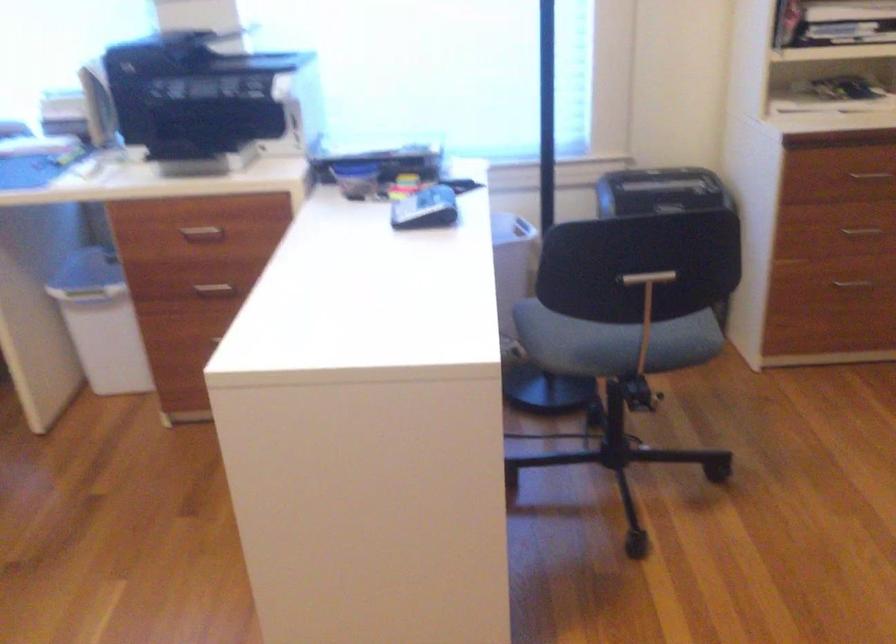
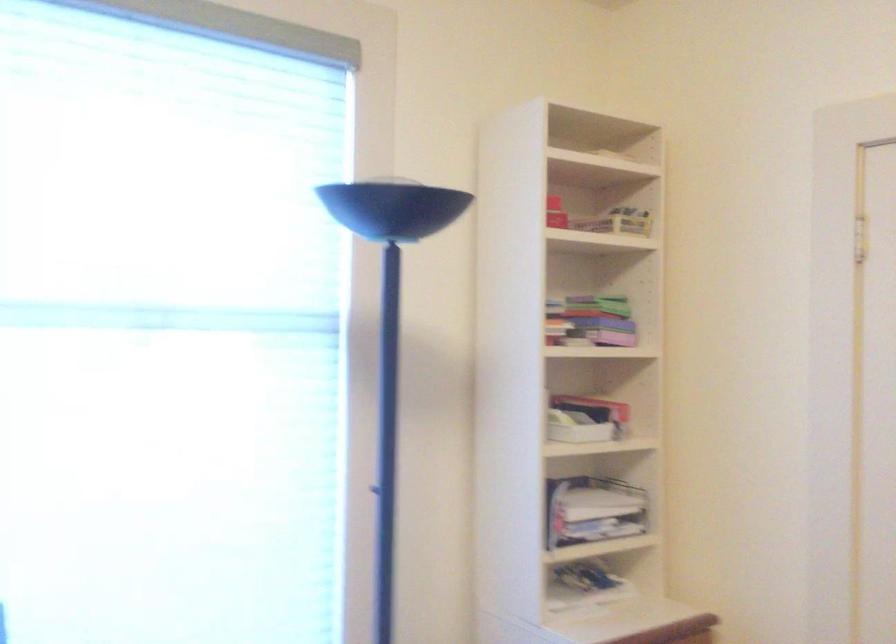
The images are taken continuously from a first-person perspective. In which direction is your viewpoint rotating?

The rotation direction of the camera is right-up.